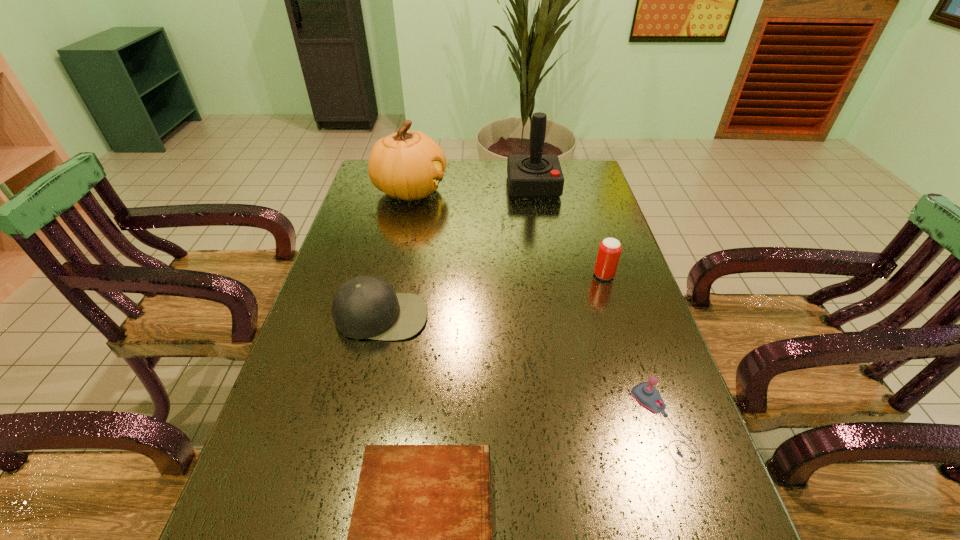
The width and height of the screenshot is (960, 540). Find the location of `the taller joystick`. the taller joystick is located at coordinates (529, 176).

You are a GUI agent. You are given a task and a screenshot of the screen. Output one action in this format:
    pyautogui.click(x=<x>, y=<y>)
    Task: Click on the left joystick
    This screenshot has height=540, width=960.
    Given the screenshot: What is the action you would take?
    point(529,176)

This screenshot has height=540, width=960. Identify the location of pumpkin. (409, 165).

Identify the location of the third farthest object. (609, 251).

In order to click on cap in this screenshot , I will do `click(363, 307)`.

Locate an element on the screen. the nearer joystick is located at coordinates (645, 393).

Locate an element on the screen. This screenshot has width=960, height=540. the second shortest object is located at coordinates (645, 393).

I want to click on vacant space located on the base of the fourth object from left to right, so click(546, 259).

The width and height of the screenshot is (960, 540). Identify the location of vacant space located on the front face of the pumpkin. (498, 191).

Find the location of `vacant space located 0.260m on the front of the third farthest object`. vacant space located 0.260m on the front of the third farthest object is located at coordinates (630, 358).